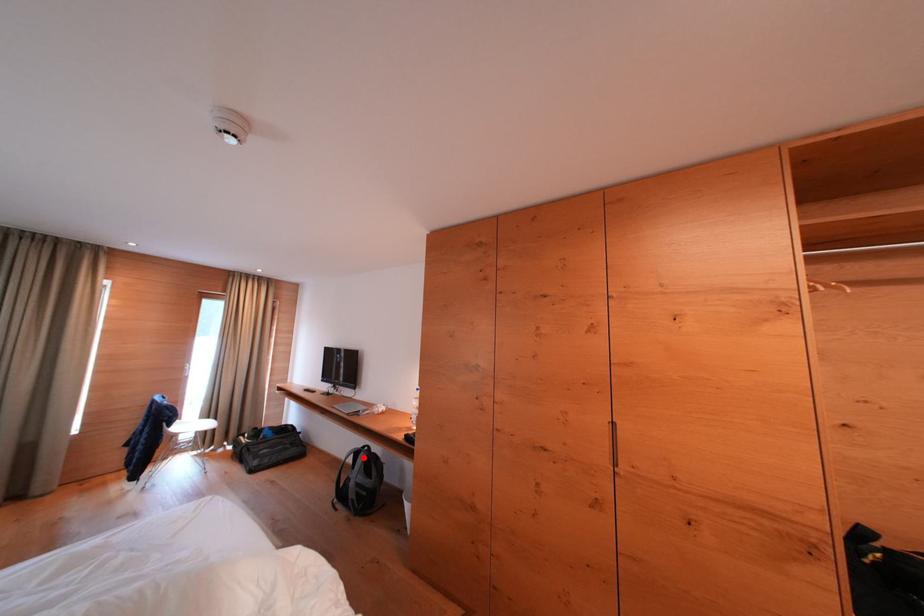
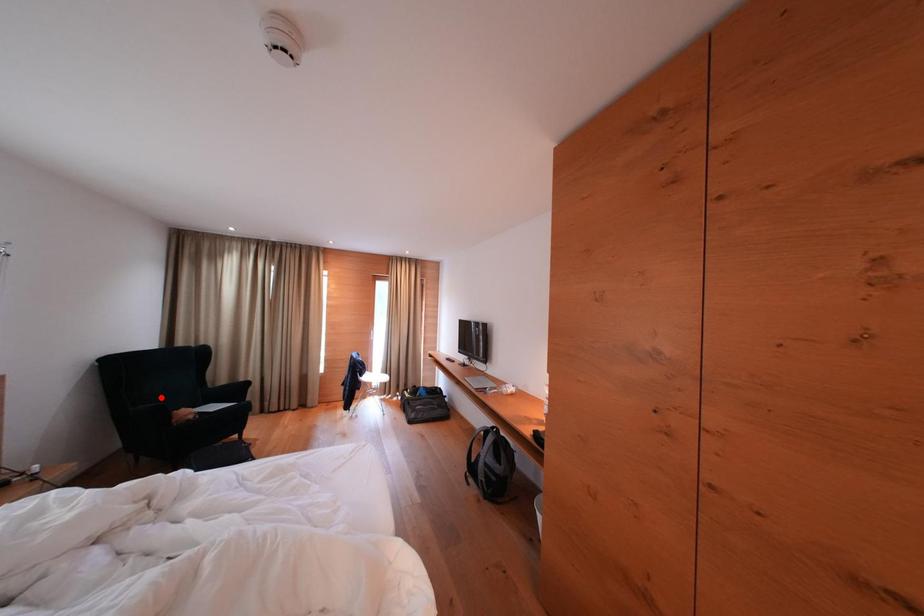
I am providing you with two images of the same scene from different viewpoints. A red point is marked on the first image and another point is marked on the second image. Is the marked point in image1 the same physical position as the marked point in image2?

No